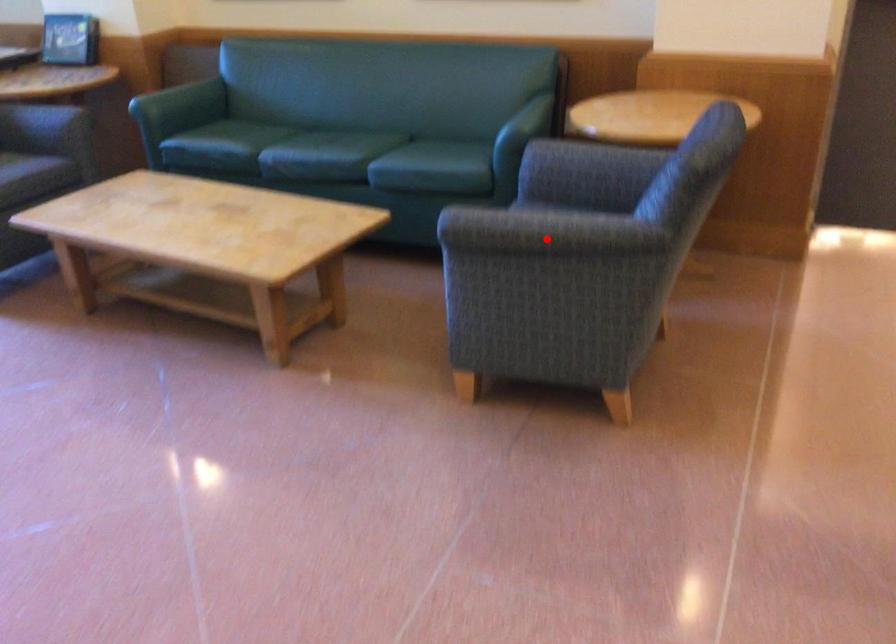
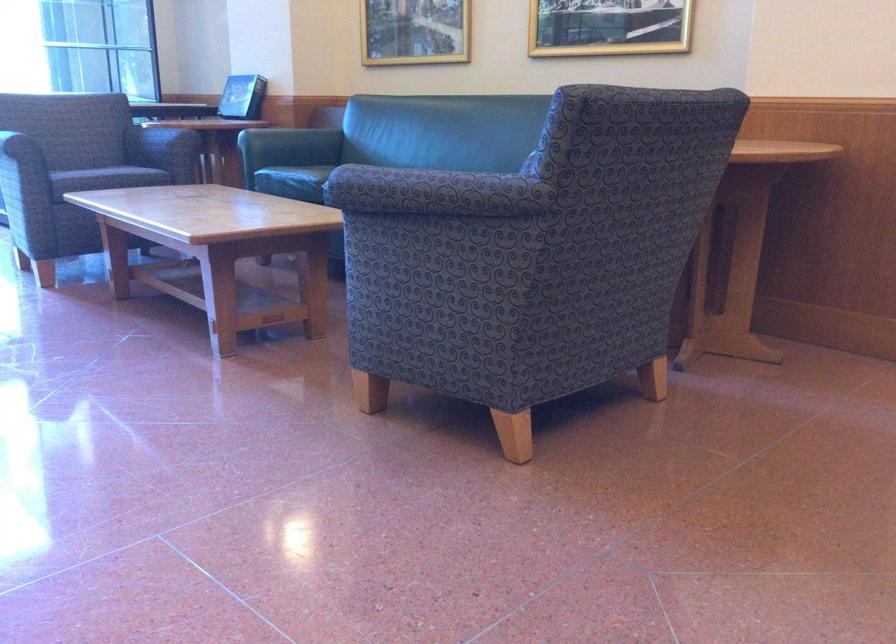
The point at the highlighted location is marked in the first image. Where is the corresponding point in the second image?

(425, 192)